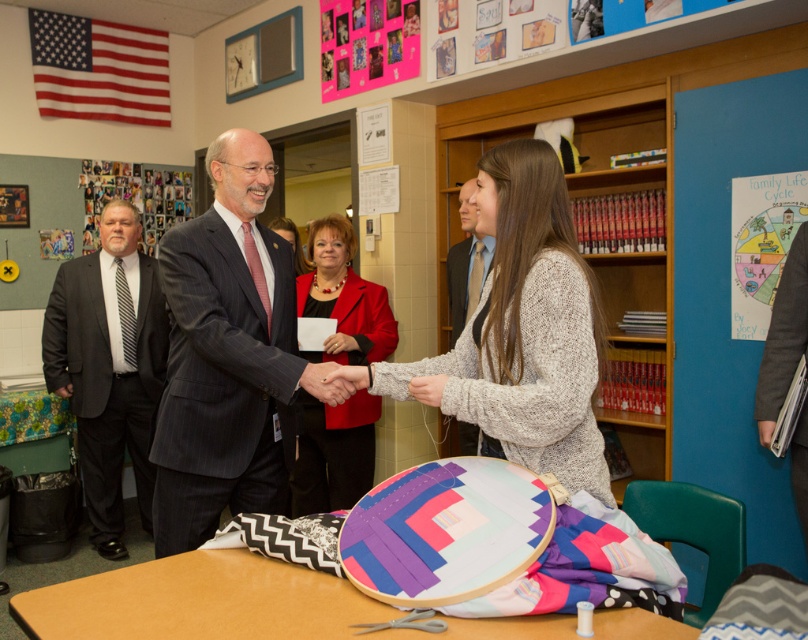
You are organizing a photo shoot and need to ensure that the knitted sweater at center and the smooth gray suit at center are visible in the frame. Given their sizes, which object should you focus on first to ensure both are properly framed?

The knitted sweater at center is larger in size than the smooth gray suit at center, so you should focus on framing the knitted sweater at center first to ensure it fits well within the shot, allowing space for the smaller smooth gray suit at center.

You are an observer in the scene and want to know which object is shorter between the knitted sweater at center and the black striped tie at left. Can you determine this?

The knitted sweater at center has a lesser height compared to the black striped tie at left, so the knitted sweater at center is shorter.

You are an observer in the scene. You notice two people at the center wearing the knitted sweater at center and the smooth gray suit at center. Which one is closer to you?

The knitted sweater at center is in front of the smooth gray suit at center, so the knitted sweater at center is closer to you.